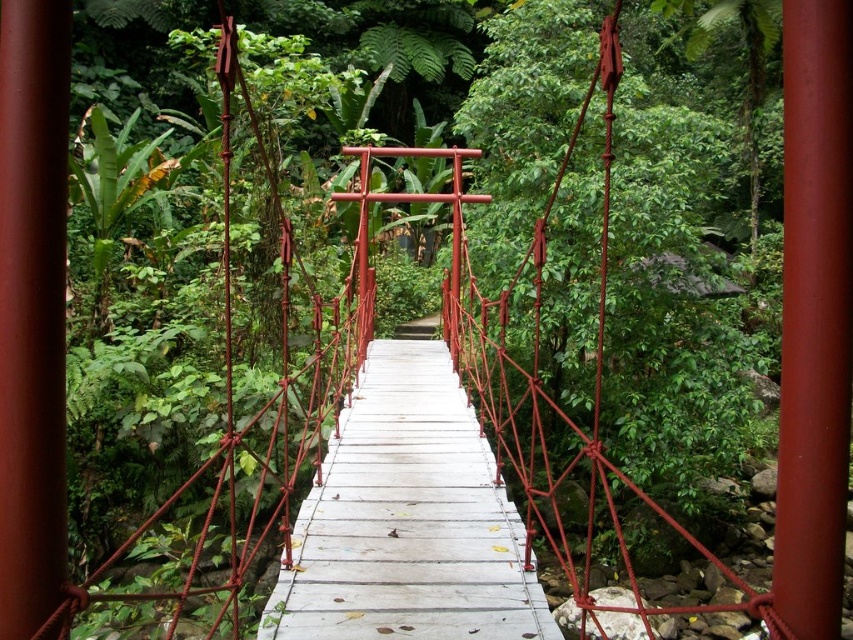
You are a painter who wants to paint all the poles on the suspension bridge. You have two types of paint cans. The first can covers 1 square meter and is for small poles, while the second can covers 2 square meters and is for large poles. You see the smooth glossy red pole at center and the smooth red pole at center. Which pole requires the larger paint can?

The smooth glossy red pole at center has a larger size compared to the smooth red pole at center, so it requires the larger paint can that covers 2 square meters.

You are standing on the rustic suspension bridge and want to reach the smooth glossy red pole at center. Given that your arm can reach up to 2 feet, can you touch the pole without moving your feet?

The smooth glossy red pole at center is 37.58 inches away from the viewer. Since 2 feet equals 24 inches, the pole is farther than your reach. Therefore, you cannot touch it without moving your feet.